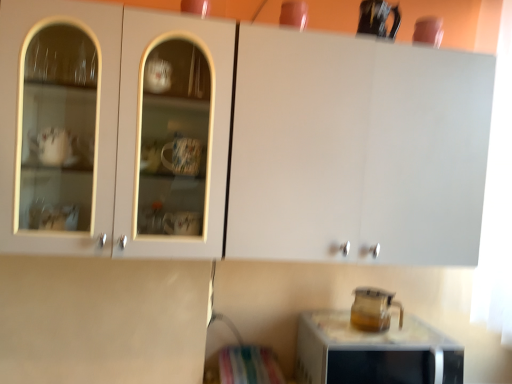
Question: Does transparent glass pitcher at lower right have a lesser height compared to matte white cabinet at upper center?

Choices:
 (A) no
 (B) yes

Answer: (B)

Question: Is transparent glass pitcher at lower right in front of matte white cabinet at upper center?

Choices:
 (A) yes
 (B) no

Answer: (B)

Question: Does transparent glass pitcher at lower right have a greater width compared to matte white cabinet at upper center?

Choices:
 (A) no
 (B) yes

Answer: (A)

Question: Considering the relative positions of transparent glass pitcher at lower right and matte white cabinet at upper center in the image provided, is transparent glass pitcher at lower right to the left of matte white cabinet at upper center from the viewer's perspective?

Choices:
 (A) no
 (B) yes

Answer: (A)

Question: Can you confirm if transparent glass pitcher at lower right is taller than matte white cabinet at upper center?

Choices:
 (A) yes
 (B) no

Answer: (B)

Question: Is transparent glass pitcher at lower right far away from matte white cabinet at upper center?

Choices:
 (A) yes
 (B) no

Answer: (B)

Question: From a real-world perspective, is transparent glass pitcher at lower right physically above matte white cabinet at upper center?

Choices:
 (A) no
 (B) yes

Answer: (A)

Question: Is transparent glass pitcher at lower right not within matte white cabinet at upper center?

Choices:
 (A) yes
 (B) no

Answer: (A)

Question: Is transparent glass pitcher at lower right oriented away from matte white cabinet at upper center?

Choices:
 (A) yes
 (B) no

Answer: (B)

Question: From a real-world perspective, is transparent glass pitcher at lower right under matte white cabinet at upper center?

Choices:
 (A) no
 (B) yes

Answer: (B)

Question: Is transparent glass pitcher at lower right in front of matte white cabinet at upper center?

Choices:
 (A) no
 (B) yes

Answer: (A)

Question: From the image's perspective, is transparent glass pitcher at lower right above matte white cabinet at upper center?

Choices:
 (A) yes
 (B) no

Answer: (B)

Question: Would you say transparent glass pitcher at lower right contains transparent glass pitcher at lower right?

Choices:
 (A) yes
 (B) no

Answer: (B)